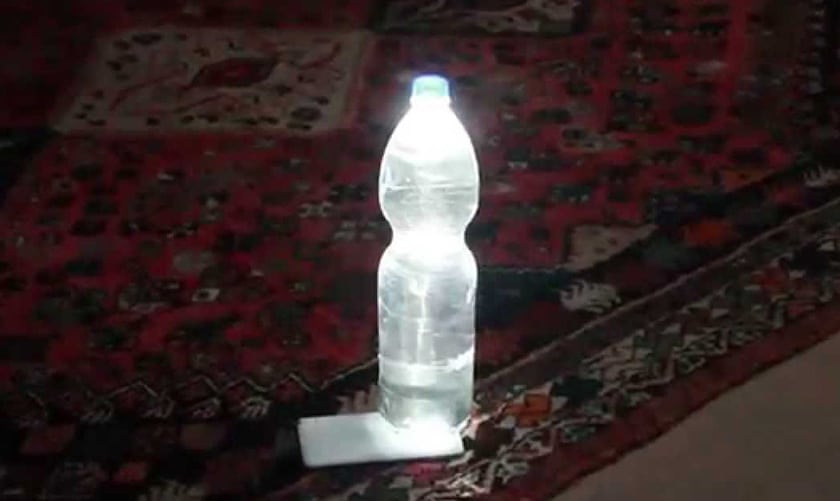
This screenshot has width=840, height=501. What are the coordinates of `edges of rug` in the screenshot? It's located at (689, 416).